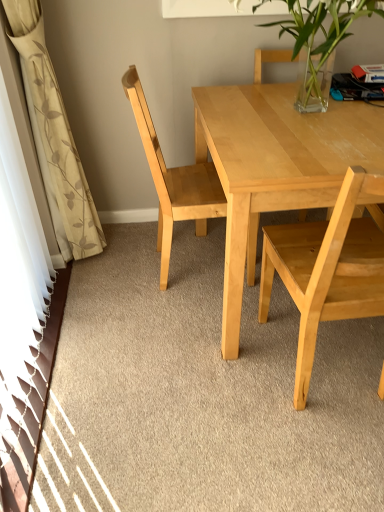
Locate an element on the screen. The width and height of the screenshot is (384, 512). free space to the left of light wood chair at center, placed as the 2th chair when sorted from right to left is located at coordinates (124, 270).